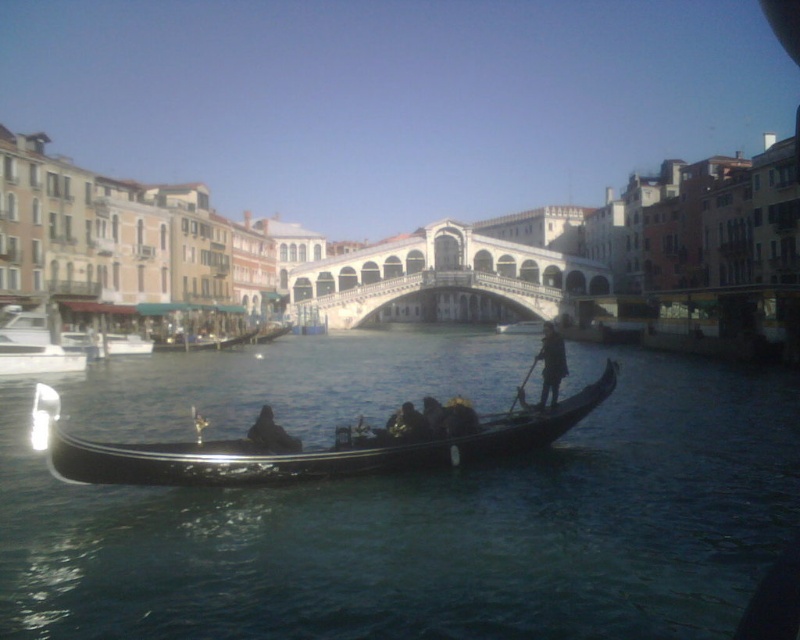
Question: Can you confirm if black polished gondola at center is bigger than dark blue fabric at center?

Choices:
 (A) no
 (B) yes

Answer: (B)

Question: Estimate the real-world distances between objects in this image. Which object is closer to the dark brown leather hat at center?

Choices:
 (A) black polished gondola at center
 (B) black water at center
 (C) dark blue fabric at center
 (D) dark brown leather jacket at center

Answer: (A)

Question: Based on their relative distances, which object is nearer to the dark blue fabric at center?

Choices:
 (A) dark brown leather jacket at center
 (B) black water at center
 (C) dark brown leather hat at center
 (D) black polished gondola at center

Answer: (A)

Question: Which object is farther from the camera taking this photo?

Choices:
 (A) white stone bridge at center
 (B) dark blue fabric at center

Answer: (A)

Question: Can you confirm if black water at center is positioned below dark brown leather jacket at center?

Choices:
 (A) yes
 (B) no

Answer: (B)

Question: Can you confirm if black water at center is positioned to the left of white stone bridge at center?

Choices:
 (A) no
 (B) yes

Answer: (B)